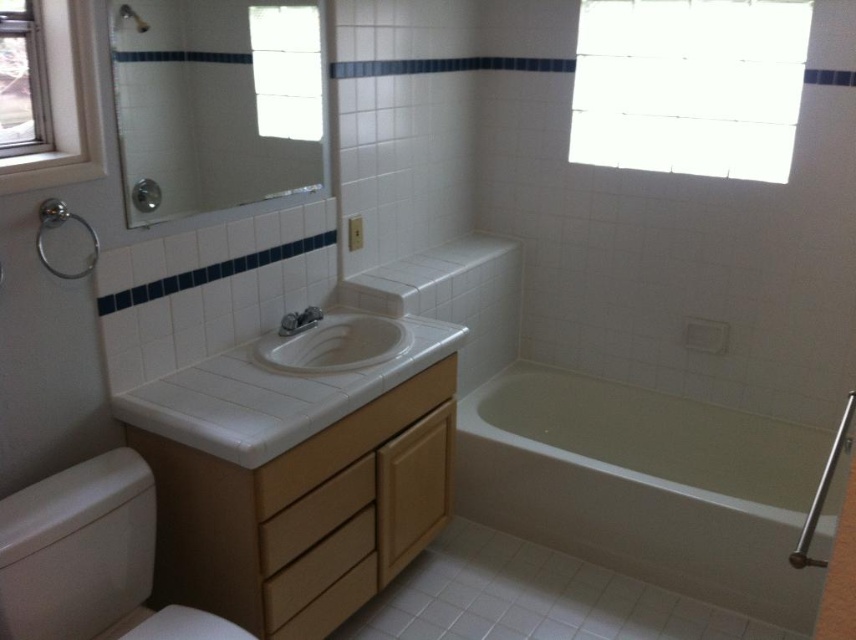
Who is higher up, transparent glass window at upper right or clear glass window at upper left?

transparent glass window at upper right is higher up.

Between transparent glass window at upper right and clear glass window at upper left, which one has more height?

With more height is transparent glass window at upper right.

This screenshot has width=856, height=640. Find the location of `transparent glass window at upper right`. transparent glass window at upper right is located at coordinates (688, 84).

Find the location of a particular element. The height and width of the screenshot is (640, 856). transparent glass window at upper right is located at coordinates (688, 84).

Does white glossy toilet bowl at lower left have a greater height compared to wooden drawer at center?

Correct, white glossy toilet bowl at lower left is much taller as wooden drawer at center.

Describe the element at coordinates (88, 557) in the screenshot. This screenshot has width=856, height=640. I see `white glossy toilet bowl at lower left` at that location.

What are the coordinates of `white glossy toilet bowl at lower left` in the screenshot? It's located at (88, 557).

At what (x,y) coordinates should I click in order to perform the action: click on white plastic window at upper left. Please return your answer as a coordinate pair (x, y). Image resolution: width=856 pixels, height=640 pixels. Looking at the image, I should click on (64, 104).

Between white plastic window at upper left and matte white shower at upper center, which one is positioned higher?

matte white shower at upper center

Where is `white plastic window at upper left`? white plastic window at upper left is located at coordinates (64, 104).